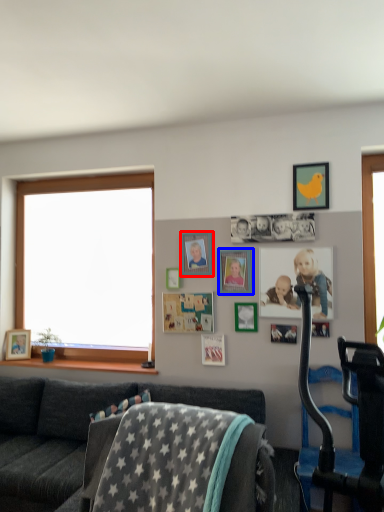
Question: Which object appears farthest to the camera in this image, picture frame (highlighted by a red box) or picture frame (highlighted by a blue box)?

Choices:
 (A) picture frame
 (B) picture frame

Answer: (A)